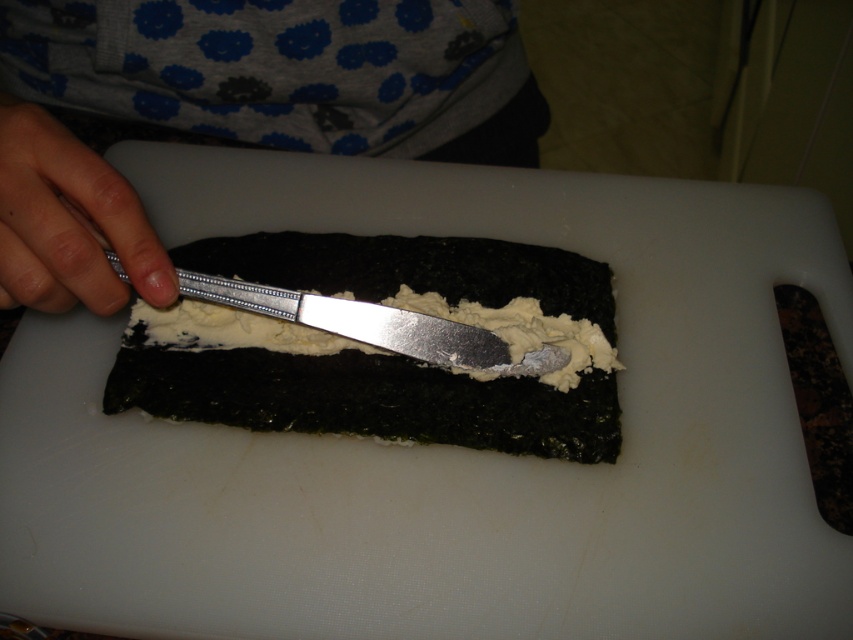
Question: Which point is farther from the camera taking this photo?

Choices:
 (A) (383, 32)
 (B) (602, 300)

Answer: (A)

Question: Can you confirm if smooth white cream at center is smaller than pale skin at knife left?

Choices:
 (A) no
 (B) yes

Answer: (A)

Question: Which object is positioned farthest from the gray fabric at upper center?

Choices:
 (A) pale skin at knife left
 (B) smooth white cream at center

Answer: (A)

Question: Which point is farther to the camera?

Choices:
 (A) (27, 144)
 (B) (405, 125)
 (C) (285, 250)

Answer: (B)

Question: Is gray fabric at upper center to the left of smooth white cream at center from the viewer's perspective?

Choices:
 (A) no
 (B) yes

Answer: (B)

Question: Observing the image, what is the correct spatial positioning of gray fabric at upper center in reference to pale skin at knife left?

Choices:
 (A) below
 (B) above

Answer: (B)